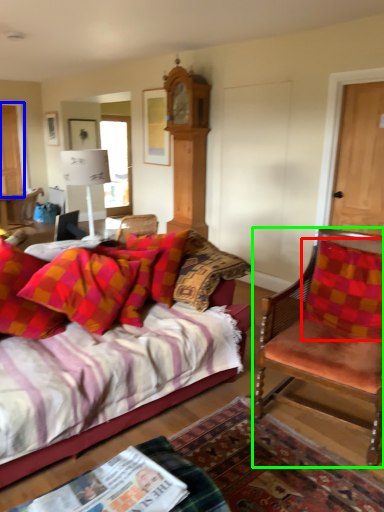
Question: Considering the real-world distances, which object is farthest from pillow (highlighted by a red box)? door (highlighted by a blue box) or chair (highlighted by a green box)?

Choices:
 (A) door
 (B) chair

Answer: (A)